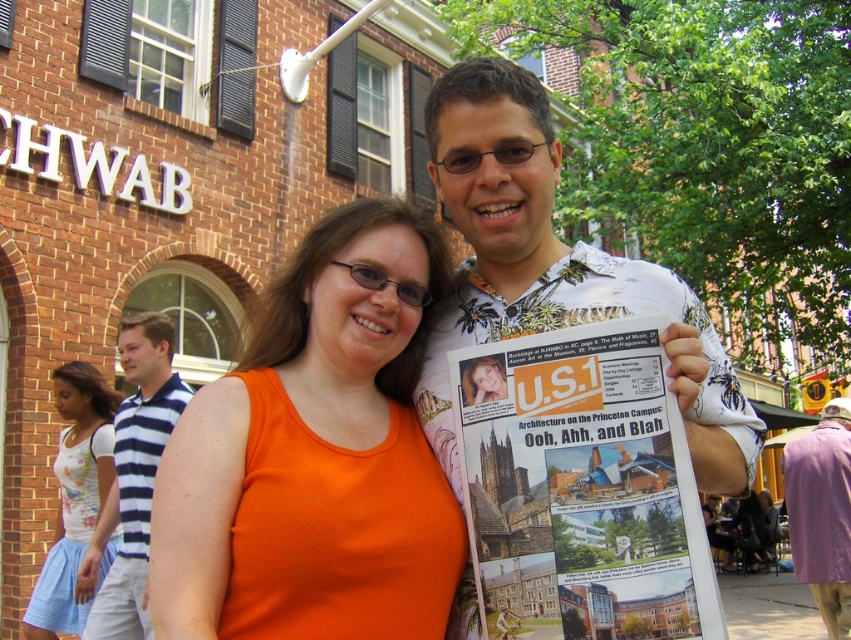
Question: Which point is closer to the camera?

Choices:
 (A) white floral shirt at center
 (B) orange fabric shirt at center
 (C) purple fabric coat at lower right

Answer: (B)

Question: Can you confirm if white floral shirt at center is bigger than purple fabric coat at lower right?

Choices:
 (A) no
 (B) yes

Answer: (B)

Question: Does orange fabric shirt at center appear under blue and white striped polo shirt at left?

Choices:
 (A) no
 (B) yes

Answer: (A)

Question: Which point is farther from the camera taking this photo?

Choices:
 (A) (437, 477)
 (B) (164, 403)
 (C) (843, 628)

Answer: (C)

Question: Can you confirm if white floral shirt at center is positioned below blue and white striped polo shirt at left?

Choices:
 (A) no
 (B) yes

Answer: (A)

Question: Which of the following is the farthest from the observer?

Choices:
 (A) (818, 596)
 (B) (480, 220)

Answer: (A)